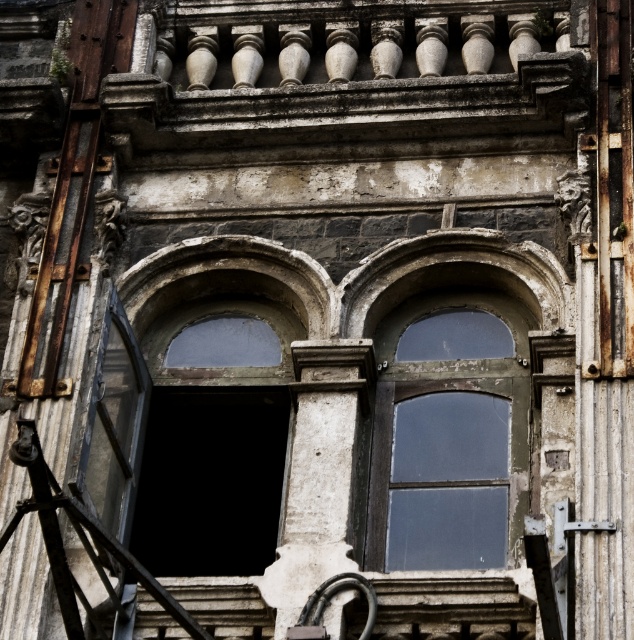
Is point (160, 116) less distant than point (503, 544)?

No, (160, 116) is behind (503, 544).

What do you see at coordinates (349, 68) in the screenshot? I see `white stone balustrade at upper center` at bounding box center [349, 68].

Does point (366, 24) come farther from viewer compared to point (455, 556)?

Yes.

The image size is (634, 640). Identify the location of white stone balustrade at upper center. (349, 68).